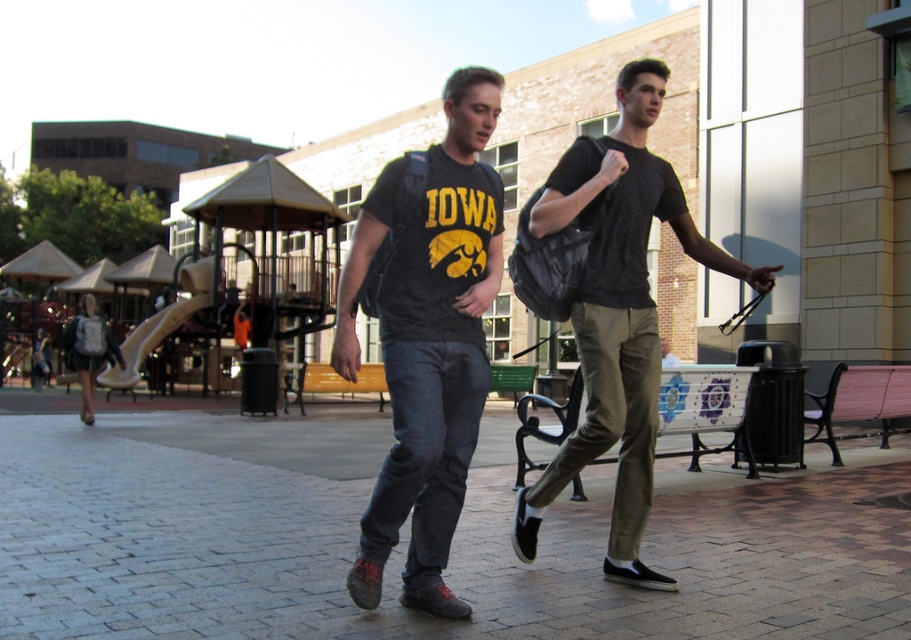
Who is taller, brick pavement at center or distressed black t-shirt at center?

With more height is distressed black t-shirt at center.

Which of these two, brick pavement at center or distressed black t-shirt at center, stands shorter?

Standing shorter between the two is brick pavement at center.

Find the location of `brick pavement at center`. brick pavement at center is located at coordinates (406, 541).

This screenshot has height=640, width=911. Find the location of `brick pavement at center`. brick pavement at center is located at coordinates (406, 541).

Is point (521, 593) positioned in front of point (648, 332)?

No, it is not.

Image resolution: width=911 pixels, height=640 pixels. Describe the element at coordinates (406, 541) in the screenshot. I see `brick pavement at center` at that location.

Find the location of a particular element. brick pavement at center is located at coordinates (406, 541).

Which is more to the right, distressed black t-shirt at center or black mesh bag at center?

From the viewer's perspective, black mesh bag at center appears more on the right side.

Does distressed black t-shirt at center appear on the left side of black mesh bag at center?

Correct, you'll find distressed black t-shirt at center to the left of black mesh bag at center.

Measure the distance between distressed black t-shirt at center and camera.

distressed black t-shirt at center is 11.92 feet from camera.

Find the location of a particular element. distressed black t-shirt at center is located at coordinates (427, 337).